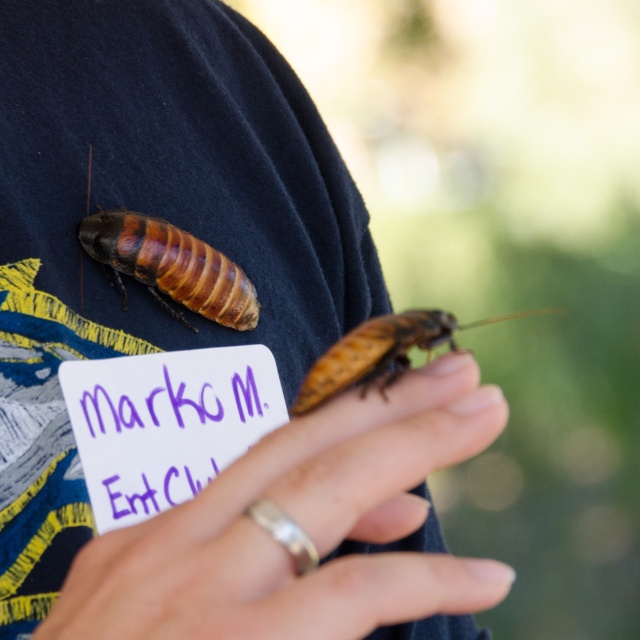
The smooth skin hand at center is located at point 0.827, 0.473. Is this hand closer to the viewer or further away?

The smooth skin hand at center is located at point (301,529), which indicates it is closer to the viewer.

Looking at the scene described, where is the smooth skin hand at center in relation to the brown shiny cockroach at center?

The smooth skin hand at center is to the left of the brown shiny cockroach at center.